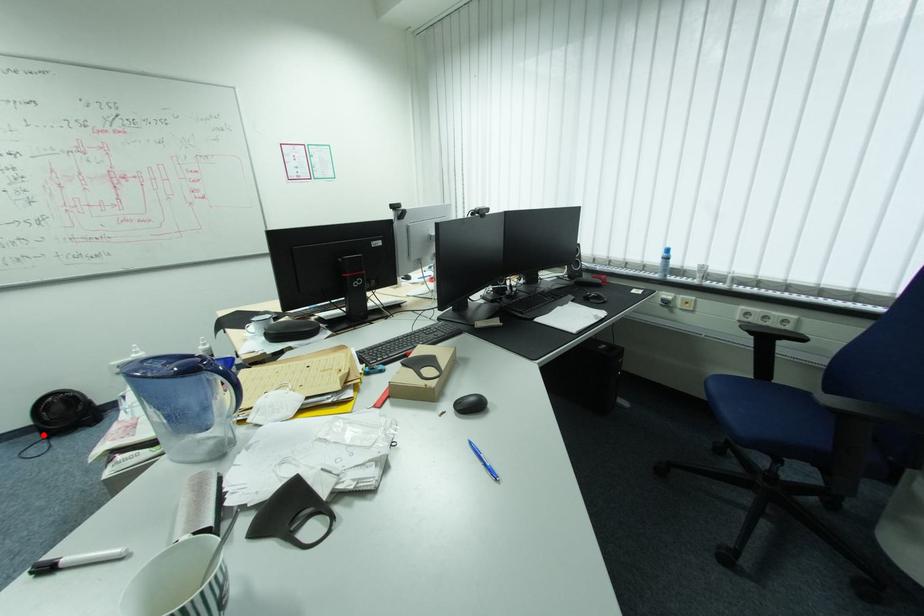
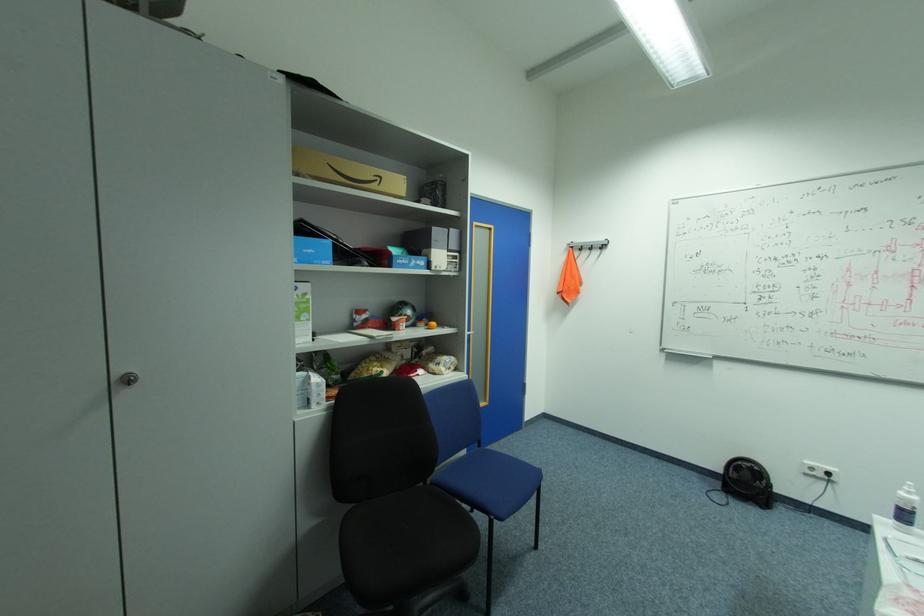
In the second image, find the point that corresponds to the highlighted location in the first image.

(724, 484)